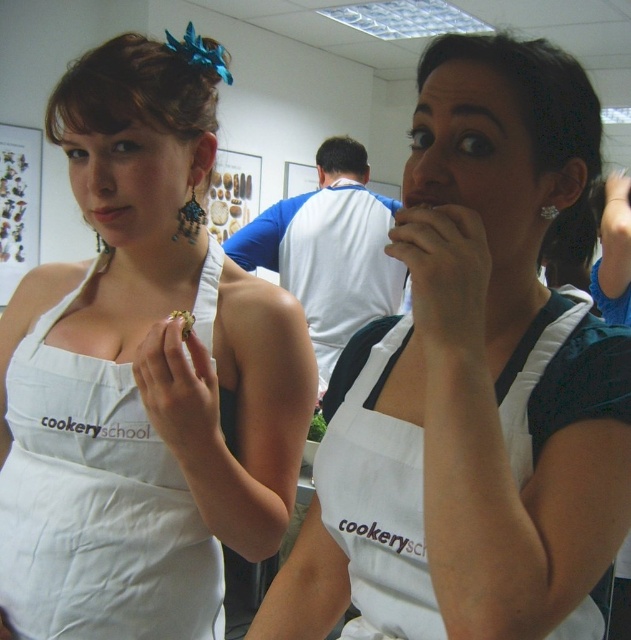
Question: Does white apron at center lie behind white cotton apron at left?

Choices:
 (A) yes
 (B) no

Answer: (B)

Question: Which of the following is the farthest from the observer?

Choices:
 (A) (550, 208)
 (B) (191, 328)
 (C) (37, 221)
 (D) (326, 422)

Answer: (C)

Question: Estimate the real-world distances between objects in this image. Which object is closer to the wooden frame at upper left?

Choices:
 (A) green leafy vegetable at center
 (B) white apron at center
 (C) white cotton apron at center
 (D) matte white apron at center

Answer: (A)

Question: Considering the real-world distances, which object is closest to the wooden frame at upper left?

Choices:
 (A) green leafy vegetable at center
 (B) matte brown seed at center
 (C) matte black mouth at center

Answer: (A)

Question: Is white cotton apron at left behind wooden frame at upper left?

Choices:
 (A) no
 (B) yes

Answer: (A)

Question: Is white cotton apron at left further to camera compared to gold metallic ring at upper center?

Choices:
 (A) no
 (B) yes

Answer: (B)